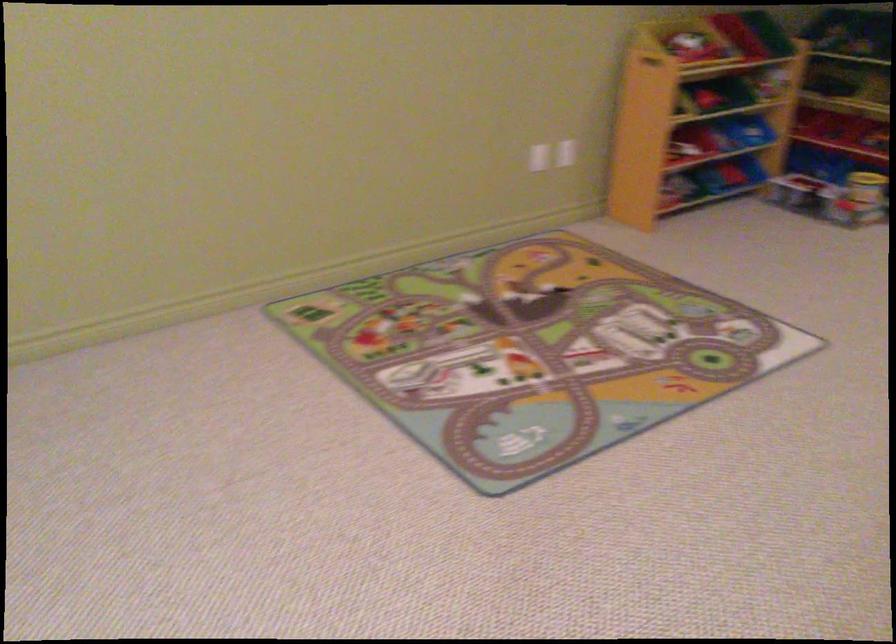
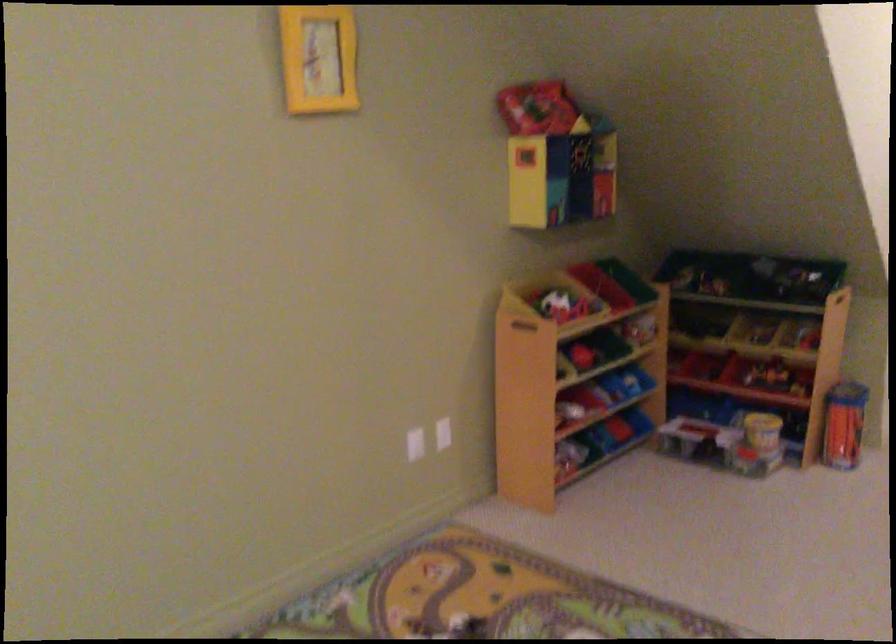
Question: I am providing you with two images of the same scene from different viewpoints. After the viewpoint changes to image2, which objects are now occluded?

Choices:
 (A) green toy bin
 (B) storage shelf handle
 (C) white toy ball
 (D) none of these

Answer: (D)